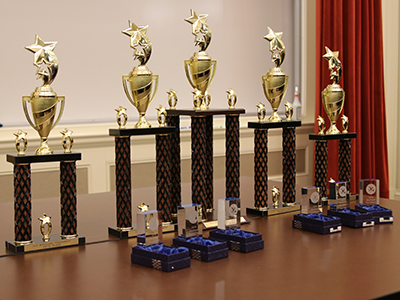
Identify the location of red curtain. Image resolution: width=400 pixels, height=300 pixels. (376, 85).